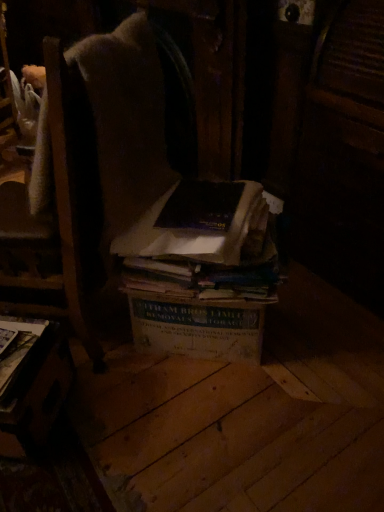
Question: In which direction should I rotate to look at dark brown paper book at center, acting as the second book starting from the left?

Choices:
 (A) left
 (B) right

Answer: (A)

Question: Is the depth of dark brown paper book at center, the second book when ordered from right to left, less than that of brown cardboard box at center, placed as the third book when sorted from left to right?

Choices:
 (A) no
 (B) yes

Answer: (B)

Question: From a real-world perspective, is dark brown paper book at center, acting as the second book starting from the left, positioned under brown cardboard box at center, placed as the third book when sorted from left to right, based on gravity?

Choices:
 (A) no
 (B) yes

Answer: (A)

Question: Considering the relative positions of dark brown paper book at center, acting as the second book starting from the left, and brown cardboard box at center, placed as the third book when sorted from left to right, in the image provided, is dark brown paper book at center, acting as the second book starting from the left, to the right of brown cardboard box at center, placed as the third book when sorted from left to right, from the viewer's perspective?

Choices:
 (A) no
 (B) yes

Answer: (A)

Question: Does dark brown paper book at center, acting as the second book starting from the left, lie behind brown cardboard box at center, placed as the third book when sorted from left to right?

Choices:
 (A) no
 (B) yes

Answer: (A)

Question: Is dark brown paper book at center, the second book when ordered from right to left, next to brown cardboard box at center, placed as the third book when sorted from left to right?

Choices:
 (A) no
 (B) yes

Answer: (B)

Question: Considering the relative sizes of dark brown paper book at center, acting as the second book starting from the left, and brown cardboard box at center, placed as the third book when sorted from left to right, in the image provided, is dark brown paper book at center, acting as the second book starting from the left, taller than brown cardboard box at center, placed as the third book when sorted from left to right,?

Choices:
 (A) no
 (B) yes

Answer: (A)

Question: Is hardcover book at lower left, the third book in the right-to-left sequence, taller than brown cardboard box at center, placed as the third book when sorted from left to right?

Choices:
 (A) yes
 (B) no

Answer: (B)

Question: Is hardcover book at lower left, the third book in the right-to-left sequence, behind brown cardboard box at center, the 1th book viewed from the right?

Choices:
 (A) yes
 (B) no

Answer: (B)

Question: Does hardcover book at lower left, the 1th book positioned from the left, have a smaller size compared to brown cardboard box at center, the 1th book viewed from the right?

Choices:
 (A) no
 (B) yes

Answer: (B)

Question: Is hardcover book at lower left, the third book in the right-to-left sequence, shorter than brown cardboard box at center, the 1th book viewed from the right?

Choices:
 (A) yes
 (B) no

Answer: (A)

Question: Is hardcover book at lower left, the third book in the right-to-left sequence, positioned with its back to brown cardboard box at center, the 1th book viewed from the right?

Choices:
 (A) yes
 (B) no

Answer: (B)

Question: Is hardcover book at lower left, the 1th book positioned from the left, surrounding brown cardboard box at center, placed as the third book when sorted from left to right?

Choices:
 (A) no
 (B) yes

Answer: (A)

Question: Is dark brown paper book at center, acting as the second book starting from the left, wider than wooden table at lower left?

Choices:
 (A) no
 (B) yes

Answer: (B)